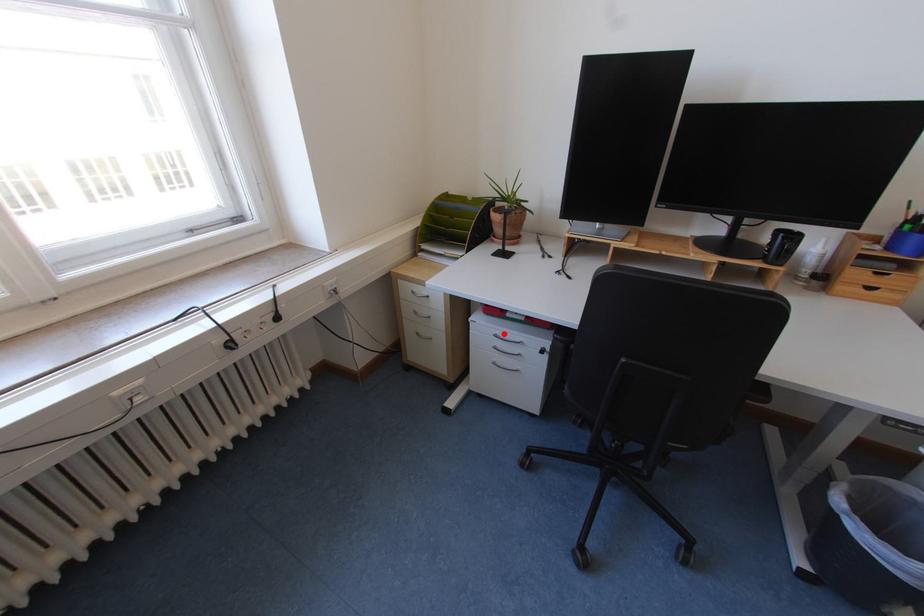
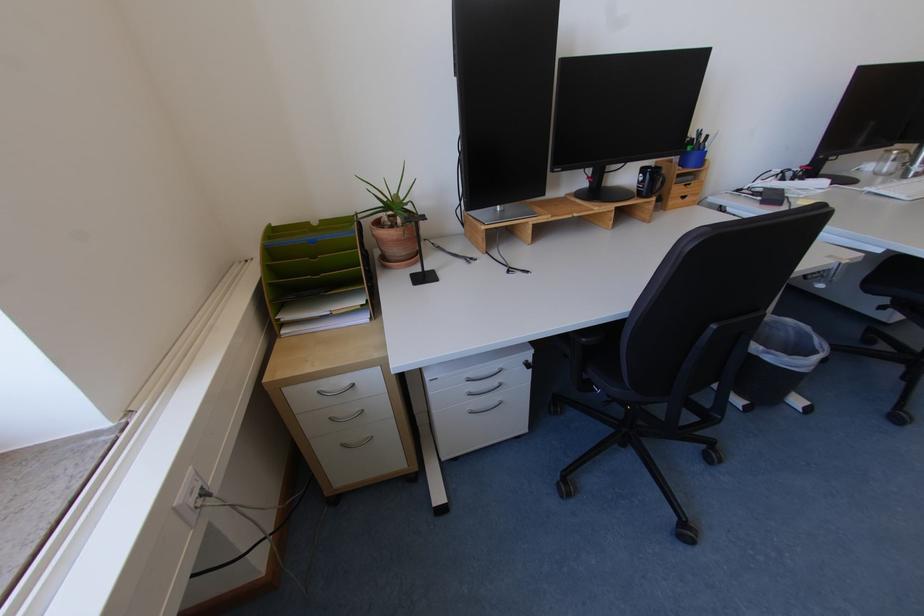
In the second image, find the point that corresponds to the highlighted location in the first image.

(475, 378)